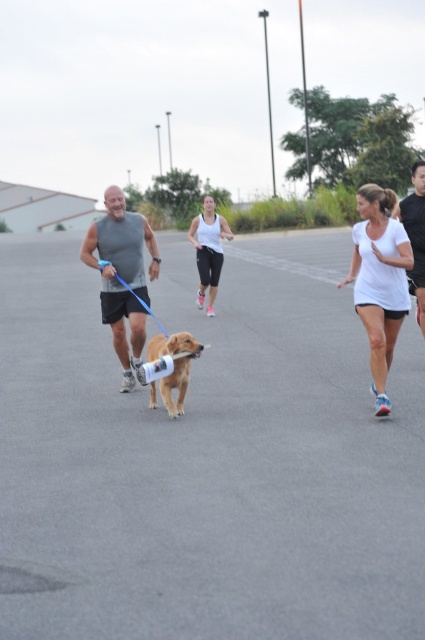
You are a photographer positioned at the origin point of the image. You want to capture a shot focusing on the matte gray tank top at center. What are the coordinates where you should aim your camera?

The matte gray tank top at center is located at point (122,276), so you should aim your camera at those coordinates to focus on it.

You are a photographer positioned behind the group of runners. You want to take a photo that includes both the white matte shirt at center and the golden matte dog at center. Based on their positions, which one should be closer to the camera?

The white matte shirt at center is in front of the golden matte dog at center, so it should be closer to the camera.